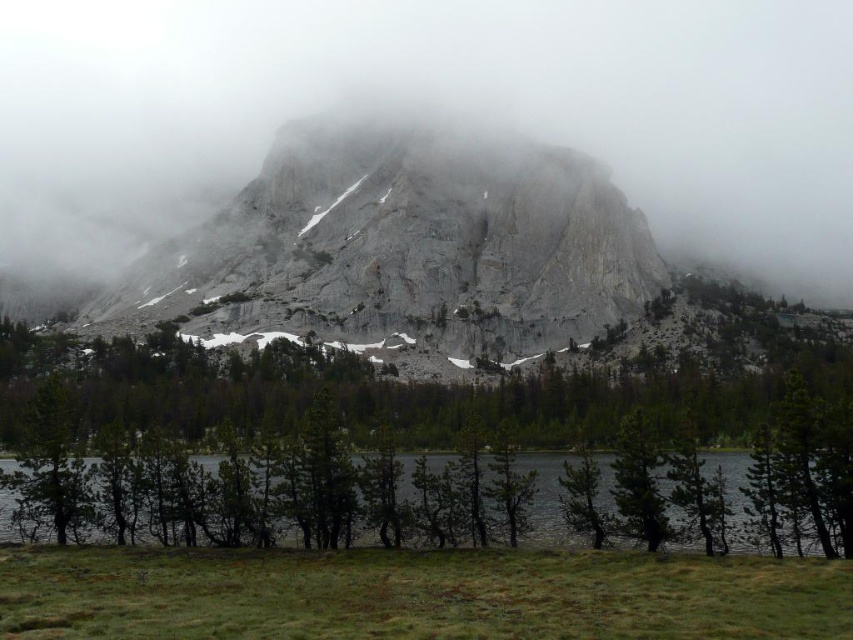
Question: Which object appears closest to the camera in this image?

Choices:
 (A) gray rock mountain at center
 (B) green matte water at lower center

Answer: (B)

Question: Among these objects, which one is nearest to the camera?

Choices:
 (A) gray rock mountain at center
 (B) green matte water at lower center

Answer: (B)

Question: Is gray rock mountain at center wider than green matte water at lower center?

Choices:
 (A) yes
 (B) no

Answer: (A)

Question: Can you confirm if gray rock mountain at center is bigger than green matte water at lower center?

Choices:
 (A) no
 (B) yes

Answer: (B)

Question: Can you confirm if gray rock mountain at center is positioned to the right of green matte water at lower center?

Choices:
 (A) yes
 (B) no

Answer: (B)